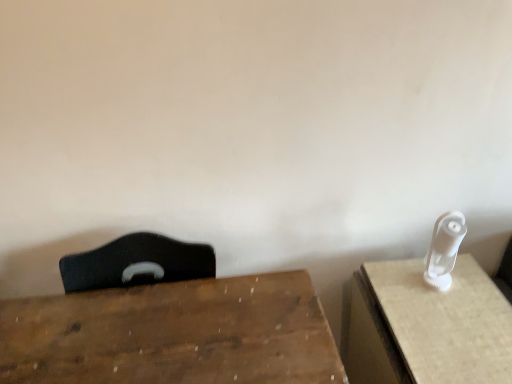
Question: Considering the positions of white plastic wii controller at right and wooden table at center, which ranks as the 1th table in left-to-right order, in the image, is white plastic wii controller at right bigger or smaller than wooden table at center, which ranks as the 1th table in left-to-right order,?

Choices:
 (A) small
 (B) big

Answer: (A)

Question: Is white plastic wii controller at right taller or shorter than wooden table at center, the 2th table positioned from the right?

Choices:
 (A) tall
 (B) short

Answer: (B)

Question: Which of these objects is positioned closest to the white plastic wii controller at right?

Choices:
 (A) white plastic toothbrush at right, which appears as the second table when viewed from the left
 (B) wooden table at center, the 2th table positioned from the right

Answer: (A)

Question: Estimate the real-world distances between objects in this image. Which object is closer to the white plastic toothbrush at right, which appears as the second table when viewed from the left?

Choices:
 (A) white plastic wii controller at right
 (B) wooden table at center, the 2th table positioned from the right

Answer: (A)